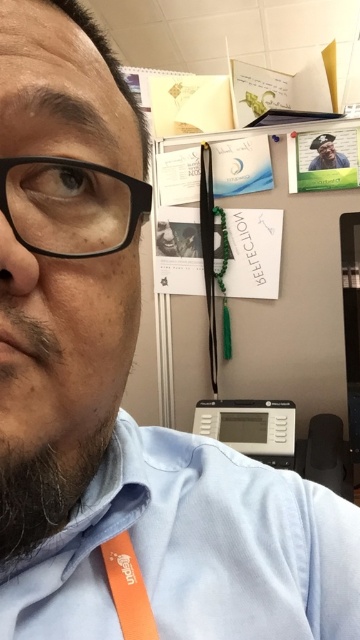
Question: Does light blue cotton dress shirt at lower left lie behind black plastic glasses at left?

Choices:
 (A) no
 (B) yes

Answer: (B)

Question: Does light blue cotton dress shirt at lower left come behind dark brown fuzzy beard at lower left?

Choices:
 (A) no
 (B) yes

Answer: (B)

Question: Which object is closer to the camera taking this photo?

Choices:
 (A) matte black photo frame at upper center
 (B) light blue cotton dress shirt at lower left
 (C) black plastic glasses at left

Answer: (C)

Question: Can you confirm if light blue cotton dress shirt at lower left is positioned below dark brown fuzzy beard at lower left?

Choices:
 (A) yes
 (B) no

Answer: (A)

Question: Based on their relative distances, which object is farther from the orange fabric tag at lower left?

Choices:
 (A) light blue cotton dress shirt at lower left
 (B) matte black photo frame at upper center
 (C) black plastic glasses at left

Answer: (B)

Question: Which point is farther to the camera?

Choices:
 (A) black plastic glasses at left
 (B) matte black photo frame at upper center

Answer: (B)